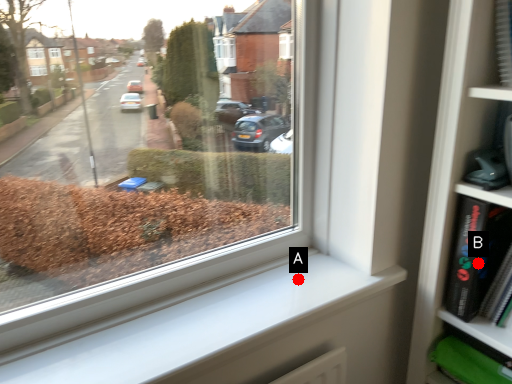
Question: Two points are circled on the image, labeled by A and B beside each circle. Which point is farther from the camera taking this photo?

Choices:
 (A) A is further
 (B) B is further

Answer: (A)